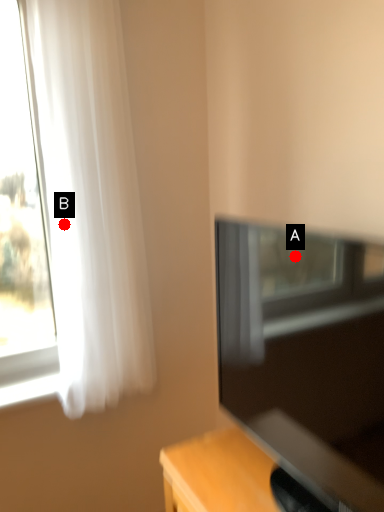
Question: Two points are circled on the image, labeled by A and B beside each circle. Among these points, which one is nearest to the camera?

Choices:
 (A) A is closer
 (B) B is closer

Answer: (A)